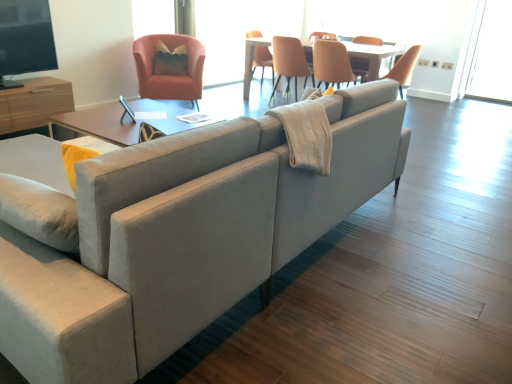
Question: In terms of width, does wooden entertainment center at left, which is counted as the second entertainment center, starting from the top, look wider or thinner when compared to matte black tv at upper left, arranged as the 2th entertainment center when ordered from the bottom?

Choices:
 (A) wide
 (B) thin

Answer: (A)

Question: From the image's perspective, is wooden entertainment center at left, marked as the 1th entertainment center in a bottom-to-top arrangement, above or below matte black tv at upper left, arranged as the 2th entertainment center when ordered from the bottom?

Choices:
 (A) above
 (B) below

Answer: (B)

Question: Estimate the real-world distances between objects in this image. Which object is closer to the matte orange chair at upper center, which is the 2th chair from right to left?

Choices:
 (A) leather-like beige chair at center, the 1th chair viewed from the right
 (B) transparent glass window screen at upper center, which is the 1th window screen from left to right
 (C) wooden entertainment center at left, marked as the 1th entertainment center in a bottom-to-top arrangement
 (D) velvet yellow pillow at upper center
 (E) matte orange armchair at upper left, marked as the first chair in a left-to-right arrangement

Answer: (A)

Question: Considering the real-world distances, which object is closest to the velvet yellow pillow at upper center?

Choices:
 (A) light gray fabric couch at center
 (B) matte orange armchair at upper left, marked as the first chair in a left-to-right arrangement
 (C) transparent glass window at upper right, which is counted as the 3th window screen, starting from the left
 (D) matte black tv at upper left, arranged as the 2th entertainment center when ordered from the bottom
 (E) matte orange chair at upper center, which is the 2th chair from right to left

Answer: (B)